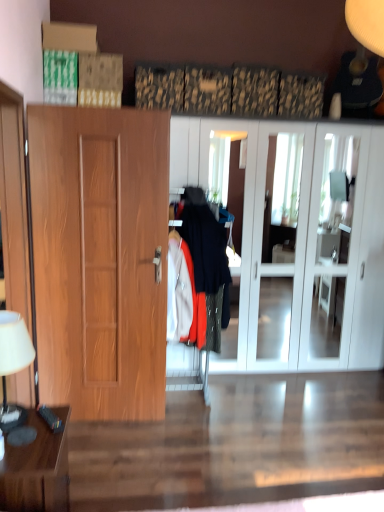
Question: From a real-world perspective, is brown wooden table at lower left above or below black plastic remote control at lower left?

Choices:
 (A) below
 (B) above

Answer: (A)

Question: From the image's perspective, is brown wooden table at lower left located above or below black plastic remote control at lower left?

Choices:
 (A) above
 (B) below

Answer: (B)

Question: Estimate the real-world distances between objects in this image. Which object is closer to the black plastic remote control at lower left?

Choices:
 (A) white glossy cabinet at center
 (B) wooden door at left
 (C) white fabric lampshade at left
 (D) brown wooden table at lower left

Answer: (D)

Question: Which object is the closest to the white fabric lampshade at left?

Choices:
 (A) black plastic remote control at lower left
 (B) brown wooden table at lower left
 (C) white glossy cabinet at center
 (D) wooden door at left

Answer: (A)